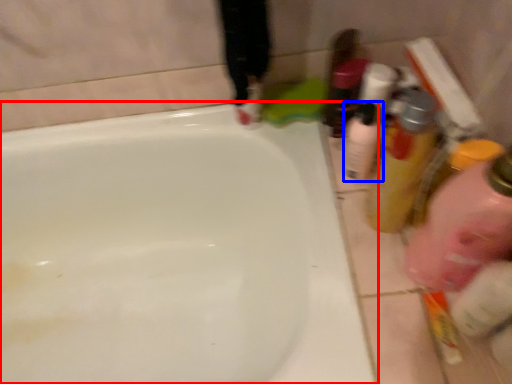
Question: Which point is closer to the camera, bathtub (highlighted by a red box) or mouthwash (highlighted by a blue box)?

Choices:
 (A) bathtub
 (B) mouthwash

Answer: (A)